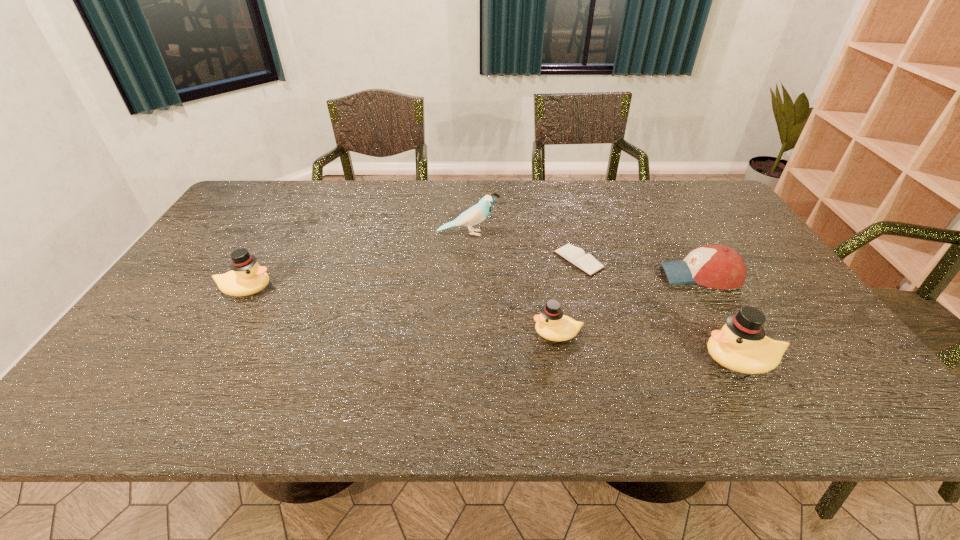
The image size is (960, 540). In order to click on the farthest duck in this screenshot , I will do `click(247, 277)`.

Locate an element on the screen. Image resolution: width=960 pixels, height=540 pixels. the leftmost object is located at coordinates (247, 277).

What are the coordinates of `the shortest duck` in the screenshot? It's located at (551, 324).

You are a GUI agent. You are given a task and a screenshot of the screen. Output one action in this format:
    pyautogui.click(x=<x>, y=<y>)
    Task: Click on the rightmost duck
    Image resolution: width=960 pixels, height=540 pixels.
    Given the screenshot: What is the action you would take?
    pyautogui.click(x=741, y=345)

Where is `the fifth object from right to left`? Image resolution: width=960 pixels, height=540 pixels. the fifth object from right to left is located at coordinates click(476, 214).

At what (x,y) coordinates should I click in order to perform the action: click on bird. Please return your answer as a coordinate pair (x, y). The height and width of the screenshot is (540, 960). Looking at the image, I should click on (476, 214).

Where is `baseball cap`? baseball cap is located at coordinates (720, 267).

At what (x,y) coordinates should I click in order to perform the action: click on diary. Please return your answer as a coordinate pair (x, y). Image resolution: width=960 pixels, height=540 pixels. Looking at the image, I should click on (586, 262).

In order to click on free space located on the front-facing side of the farthest duck in this screenshot , I will do `click(293, 289)`.

Locate an element on the screen. This screenshot has height=540, width=960. vacant area situated 0.390m on the front-facing side of the shortest duck is located at coordinates (371, 333).